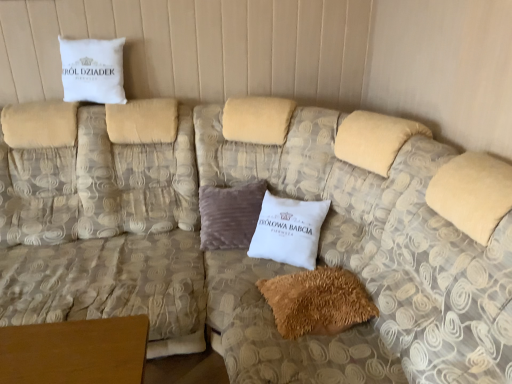
Question: From a real-world perspective, is beige fabric couch at upper left physically below white cotton pillow at upper left, the 1th pillow in the top-to-bottom sequence?

Choices:
 (A) yes
 (B) no

Answer: (A)

Question: Is beige fabric couch at upper left behind white cotton pillow at upper left, the 1th pillow in the back-to-front sequence?

Choices:
 (A) yes
 (B) no

Answer: (B)

Question: Does beige fabric couch at upper left lie in front of white cotton pillow at upper left, the 1th pillow in the top-to-bottom sequence?

Choices:
 (A) yes
 (B) no

Answer: (A)

Question: Does beige fabric couch at upper left turn towards white cotton pillow at upper left, positioned as the second pillow in bottom-to-top order?

Choices:
 (A) yes
 (B) no

Answer: (B)

Question: Considering the relative sizes of beige fabric couch at upper left and white cotton pillow at upper left, which ranks as the second pillow in front-to-back order, in the image provided, is beige fabric couch at upper left shorter than white cotton pillow at upper left, which ranks as the second pillow in front-to-back order,?

Choices:
 (A) no
 (B) yes

Answer: (A)

Question: Can we say beige fabric couch at upper left lies outside white cotton pillow at upper left, which ranks as the second pillow in front-to-back order?

Choices:
 (A) no
 (B) yes

Answer: (B)

Question: Does brown fuzzy pillow at lower center, acting as the second pillow starting from the left, have a lesser height compared to white cotton pillow at upper left, the 1th pillow in the top-to-bottom sequence?

Choices:
 (A) no
 (B) yes

Answer: (B)

Question: From a real-world perspective, is brown fuzzy pillow at lower center, the second pillow when ordered from back to front, on white cotton pillow at upper left, which ranks as the second pillow in front-to-back order?

Choices:
 (A) yes
 (B) no

Answer: (B)

Question: Is brown fuzzy pillow at lower center, acting as the second pillow starting from the left, positioned in front of white cotton pillow at upper left, positioned as the second pillow in bottom-to-top order?

Choices:
 (A) yes
 (B) no

Answer: (A)

Question: From the image's perspective, is brown fuzzy pillow at lower center, which is the 1th pillow from front to back, located beneath white cotton pillow at upper left, which ranks as the second pillow in front-to-back order?

Choices:
 (A) no
 (B) yes

Answer: (B)

Question: Is there a large distance between brown fuzzy pillow at lower center, the second pillow when ordered from back to front, and white cotton pillow at upper left, which is the second pillow in right-to-left order?

Choices:
 (A) no
 (B) yes

Answer: (B)

Question: Does brown fuzzy pillow at lower center, the second pillow when ordered from back to front, touch white cotton pillow at upper left, which appears as the first pillow when viewed from the left?

Choices:
 (A) yes
 (B) no

Answer: (B)

Question: Is white cotton pillow at upper left, positioned as the second pillow in bottom-to-top order, surrounding beige fabric couch at upper left?

Choices:
 (A) no
 (B) yes

Answer: (A)